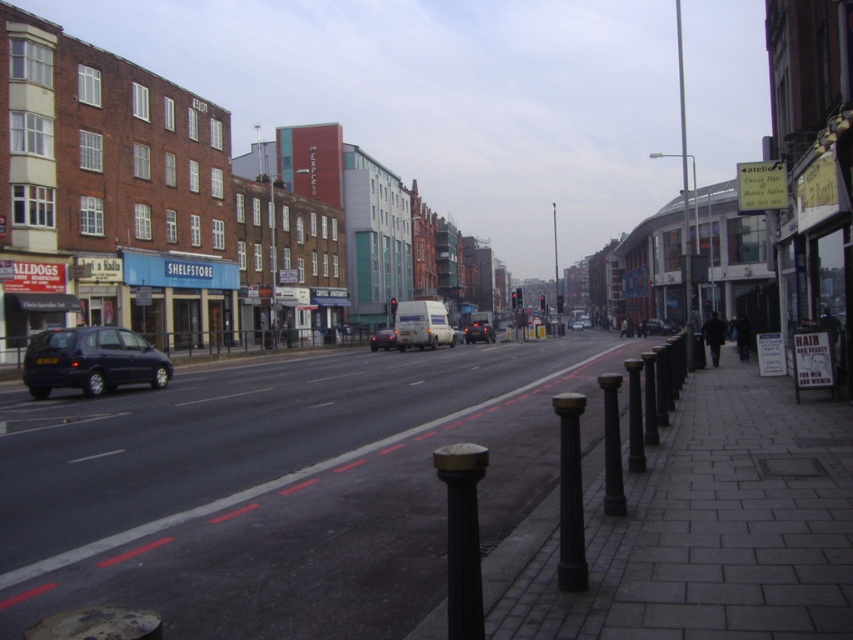
You are a delivery driver who needs to park your matte black car at center as close as possible to the black metal pole at right without blocking traffic. Given that the parking space must be at least 3 meters away from the pole, can you park your car in this location?

The black metal pole at right is 126.48 meters from the matte black car at center. Since the required parking distance is at least 3 meters, the car is already far enough away from the pole. Therefore, you can park the matte black car at center here without violating the parking rule.

You are a delivery person standing at the point labeled as point (634, 417). You need to deliver a package to the red brick building on the left side of the street. Which direction should you walk to reach the red brick building?

The black metal pole at lower right is represented by point (634, 417). To reach the red brick building on the left side of the street, you should walk towards the left.

You are a delivery robot positioned at the central reservation of the street. You need to navigate to a delivery point located at point (x=561, y=440) and point (x=572, y=323). Which point should you reach first if you want to follow the shortest path from your current position?

Point (x=561, y=440) is in front of point (x=572, y=323), so you should reach point (x=561, y=440) first as it is closer to your current position at the central reservation.